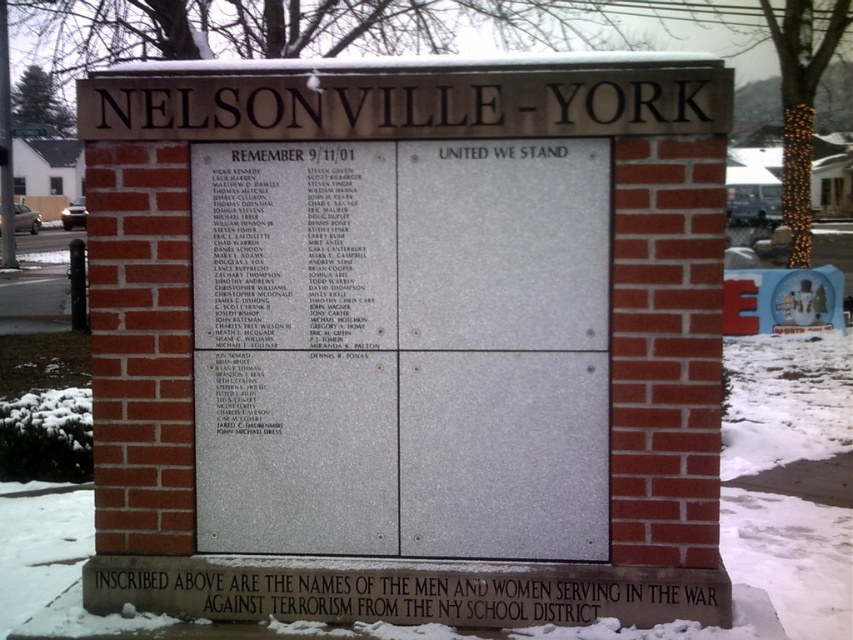
Question: Can you confirm if black polished stone plaque at center is positioned above white powdery snow at lower center?

Choices:
 (A) yes
 (B) no

Answer: (A)

Question: Which point appears farthest from the camera in this image?

Choices:
 (A) (360, 160)
 (B) (746, 513)

Answer: (B)

Question: Which point is farther from the camera taking this photo?

Choices:
 (A) (341, 609)
 (B) (602, 252)
 (C) (796, 369)

Answer: (C)

Question: Can you confirm if black polished stone plaque at center is positioned above black stone plaque at lower center?

Choices:
 (A) no
 (B) yes

Answer: (B)

Question: Which point is closer to the camera taking this photo?

Choices:
 (A) (349, 264)
 (B) (631, 605)

Answer: (B)

Question: Does black polished stone plaque at center have a lesser width compared to black stone plaque at lower center?

Choices:
 (A) yes
 (B) no

Answer: (A)